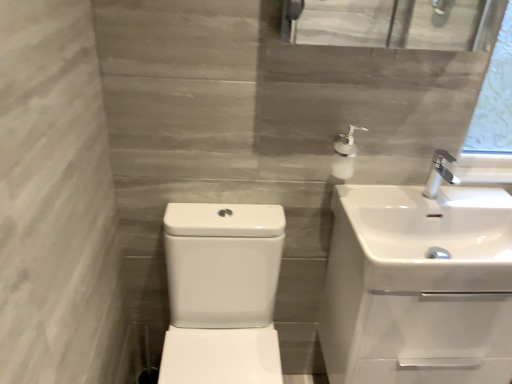
Question: Is white glossy sink at center, which is the third sink from right to left, far away from white glossy sink at upper right, which ranks as the 3th sink in left-to-right order?

Choices:
 (A) yes
 (B) no

Answer: (B)

Question: Is white glossy sink at center, which is counted as the first sink, starting from the left, bigger than white glossy sink at upper right, which is the 1th sink in right-to-left order?

Choices:
 (A) no
 (B) yes

Answer: (B)

Question: Does white glossy sink at center, which is the third sink from right to left, come in front of white glossy sink at upper right, which ranks as the 3th sink in left-to-right order?

Choices:
 (A) yes
 (B) no

Answer: (A)

Question: Can you confirm if white glossy sink at center, which is the third sink from right to left, is smaller than white glossy sink at upper right, which ranks as the 3th sink in left-to-right order?

Choices:
 (A) yes
 (B) no

Answer: (B)

Question: Is white glossy sink at center, which is counted as the first sink, starting from the left, to the left of white glossy sink at upper right, which is the 1th sink in right-to-left order, from the viewer's perspective?

Choices:
 (A) yes
 (B) no

Answer: (A)

Question: Does white glossy sink at center, which is counted as the first sink, starting from the left, have a greater height compared to white glossy sink at upper right, which is the 1th sink in right-to-left order?

Choices:
 (A) no
 (B) yes

Answer: (B)

Question: Is white glossy soap dispenser at upper right thinner than white glossy sink at upper right, which is the 1th sink in right-to-left order?

Choices:
 (A) yes
 (B) no

Answer: (A)

Question: Considering the relative sizes of white glossy soap dispenser at upper right and white glossy sink at upper right, which ranks as the 3th sink in left-to-right order, in the image provided, is white glossy soap dispenser at upper right wider than white glossy sink at upper right, which ranks as the 3th sink in left-to-right order,?

Choices:
 (A) yes
 (B) no

Answer: (B)

Question: Does white glossy soap dispenser at upper right lie behind white glossy sink at upper right, which ranks as the 3th sink in left-to-right order?

Choices:
 (A) no
 (B) yes

Answer: (B)

Question: Is white glossy soap dispenser at upper right shorter than white glossy sink at upper right, which ranks as the 3th sink in left-to-right order?

Choices:
 (A) yes
 (B) no

Answer: (A)

Question: From the image's perspective, does white glossy soap dispenser at upper right appear higher than white glossy sink at upper right, which ranks as the 3th sink in left-to-right order?

Choices:
 (A) yes
 (B) no

Answer: (A)

Question: Is white glossy soap dispenser at upper right beside white glossy sink at upper right, which ranks as the 3th sink in left-to-right order?

Choices:
 (A) no
 (B) yes

Answer: (A)

Question: Is white glossy soap dispenser at upper right shorter than white glossy sink at center, which is the third sink from right to left?

Choices:
 (A) no
 (B) yes

Answer: (B)